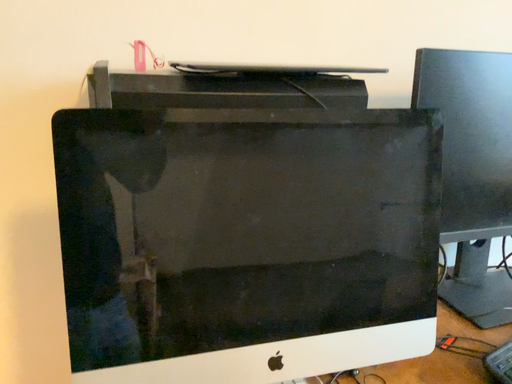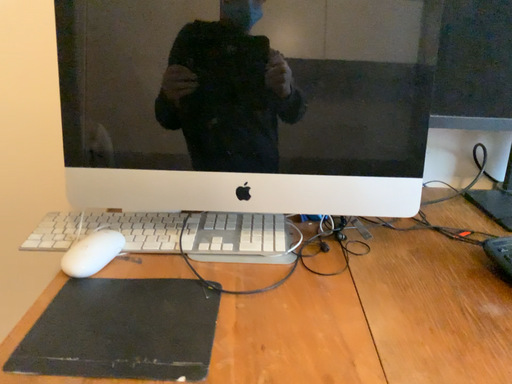
Question: How did the camera likely rotate when shooting the video?

Choices:
 (A) rotated right
 (B) rotated left

Answer: (B)